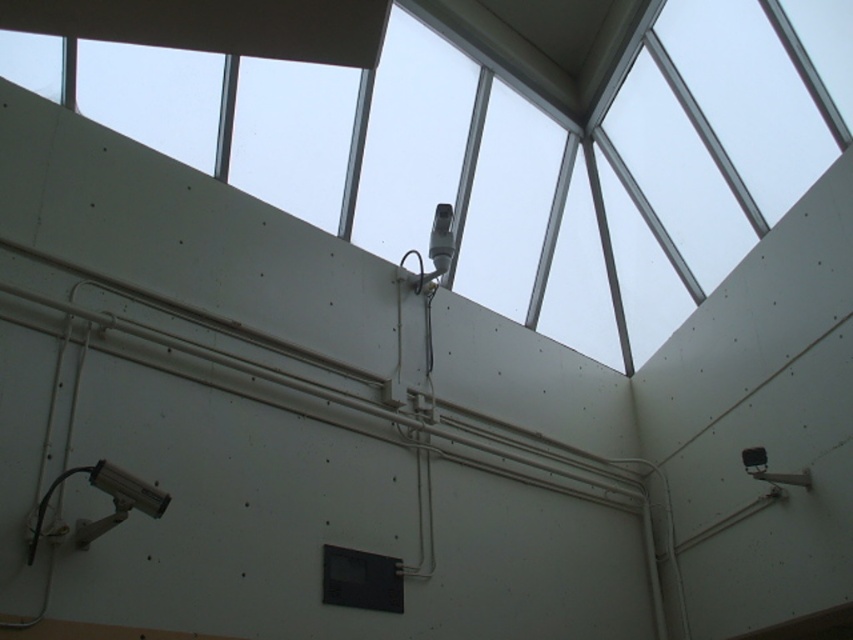
Looking at this image, is transparent glass window at upper center wider than black matte window at center?

Correct, the width of transparent glass window at upper center exceeds that of black matte window at center.

Does transparent glass window at upper center come behind black matte window at center?

Yes, transparent glass window at upper center is further from the viewer.

Which is in front, point (596, 262) or point (334, 573)?

Point (334, 573) is in front.

At what (x,y) coordinates should I click in order to perform the action: click on transparent glass window at upper center. Please return your answer as a coordinate pair (x, y). The width and height of the screenshot is (853, 640). Looking at the image, I should click on (718, 144).